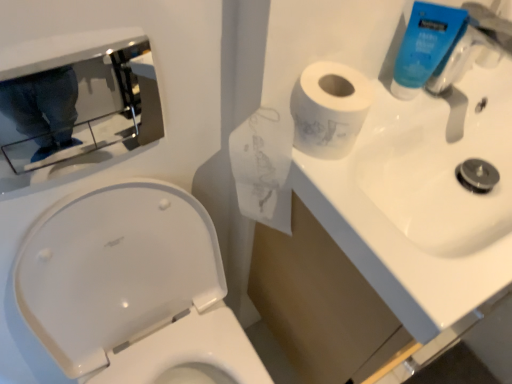
Question: Does white glossy sink at upper right have a smaller size compared to white glossy toilet at lower left?

Choices:
 (A) yes
 (B) no

Answer: (A)

Question: Is white glossy sink at upper right located outside white glossy toilet at lower left?

Choices:
 (A) no
 (B) yes

Answer: (B)

Question: From a real-world perspective, is white glossy sink at upper right on top of white glossy toilet at lower left?

Choices:
 (A) no
 (B) yes

Answer: (B)

Question: Is white glossy sink at upper right at the right side of white glossy toilet at lower left?

Choices:
 (A) yes
 (B) no

Answer: (A)

Question: Is white glossy sink at upper right wider than white glossy toilet at lower left?

Choices:
 (A) yes
 (B) no

Answer: (B)

Question: Is point (398, 69) positioned closer to the camera than point (462, 64)?

Choices:
 (A) closer
 (B) farther

Answer: (A)

Question: Based on their positions, is blue plastic tube at upper right located to the left or right of blue plastic faucet at upper right?

Choices:
 (A) left
 (B) right

Answer: (A)

Question: In terms of height, does blue plastic tube at upper right look taller or shorter compared to blue plastic faucet at upper right?

Choices:
 (A) short
 (B) tall

Answer: (A)

Question: Considering their positions, is blue plastic tube at upper right located in front of or behind blue plastic faucet at upper right?

Choices:
 (A) front
 (B) behind

Answer: (B)

Question: Is polished chrome mirror at upper left wider or thinner than blue plastic tube at upper right?

Choices:
 (A) thin
 (B) wide

Answer: (A)

Question: Based on their positions, is polished chrome mirror at upper left located to the left or right of blue plastic tube at upper right?

Choices:
 (A) left
 (B) right

Answer: (A)

Question: In the image, is polished chrome mirror at upper left positioned in front of or behind blue plastic tube at upper right?

Choices:
 (A) front
 (B) behind

Answer: (A)

Question: Considering the positions of polished chrome mirror at upper left and blue plastic tube at upper right in the image, is polished chrome mirror at upper left taller or shorter than blue plastic tube at upper right?

Choices:
 (A) tall
 (B) short

Answer: (A)

Question: Is point [x=25, y=248] positioned closer to the camera than point [x=428, y=87]?

Choices:
 (A) farther
 (B) closer

Answer: (B)

Question: Is white glossy toilet at lower left wider or thinner than blue plastic faucet at upper right?

Choices:
 (A) wide
 (B) thin

Answer: (A)